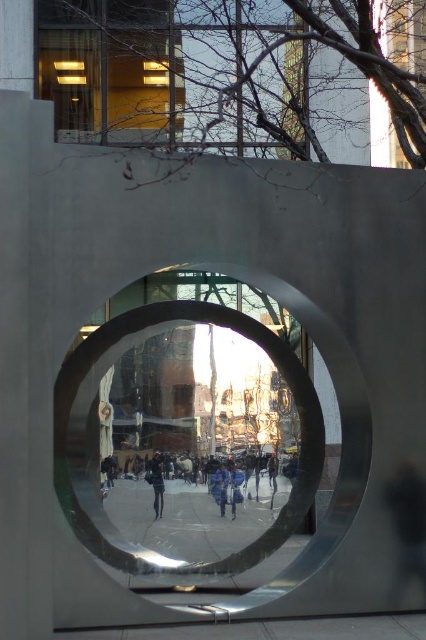
You are an architect visiting the city and notice the polished silver circle at center and the dark gray fabric at center in the scene. Which object takes up more space in the image?

The polished silver circle at center is bigger than dark gray fabric at center, so it takes up more space in the image.

You are an architect designing a new public space and want to incorporate both the polished silver circle at center and the dark gray fabric at center into your design. Based on the scene, which object should be placed closer to the entrance to ensure visitors can easily see the city view through the circular frame?

The polished silver circle at center should be placed closer to the entrance because it is wider than the dark gray fabric at center, allowing for a broader view of the city through its frame.